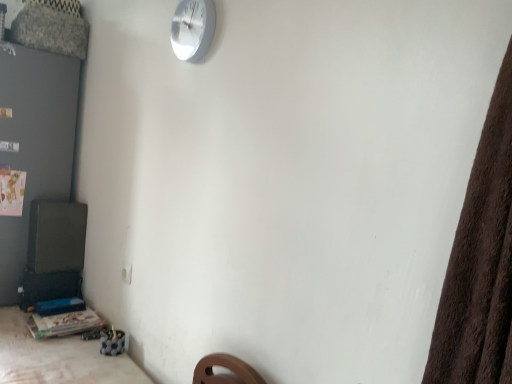
Question: From the image's perspective, is white metallic wall clock at upper center above or below wooden table at lower left?

Choices:
 (A) above
 (B) below

Answer: (A)

Question: From their relative heights in the image, would you say white metallic wall clock at upper center is taller or shorter than wooden table at lower left?

Choices:
 (A) short
 (B) tall

Answer: (A)

Question: Considering the real-world distances, which object is closest to the wooden table at lower left?

Choices:
 (A) wooden table at lower left
 (B) white metallic wall clock at upper center

Answer: (A)

Question: Based on their relative distances, which object is farther from the white metallic wall clock at upper center?

Choices:
 (A) wooden table at lower left
 (B) wooden table at lower left

Answer: (A)